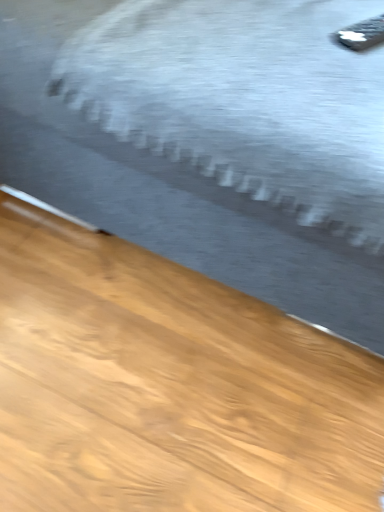
Question: Based on their positions, is black plastic remote at upper right located to the left or right of gray fabric bed at upper center?

Choices:
 (A) left
 (B) right

Answer: (B)

Question: Is point (352, 48) closer or farther from the camera than point (18, 108)?

Choices:
 (A) closer
 (B) farther

Answer: (A)

Question: Do you think black plastic remote at upper right is within gray fabric bed at upper center, or outside of it?

Choices:
 (A) inside
 (B) outside

Answer: (A)

Question: Does point (256, 184) appear closer or farther from the camera than point (336, 33)?

Choices:
 (A) closer
 (B) farther

Answer: (A)

Question: Is gray fabric bed at upper center bigger or smaller than black plastic remote at upper right?

Choices:
 (A) small
 (B) big

Answer: (B)

Question: Is gray fabric bed at upper center situated inside black plastic remote at upper right or outside?

Choices:
 (A) outside
 (B) inside

Answer: (A)

Question: Considering the positions of gray fabric bed at upper center and black plastic remote at upper right in the image, is gray fabric bed at upper center taller or shorter than black plastic remote at upper right?

Choices:
 (A) short
 (B) tall

Answer: (B)